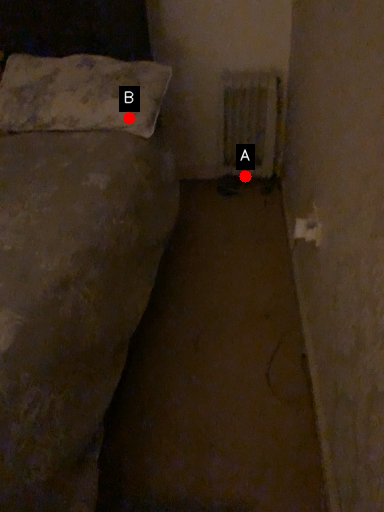
Question: Two points are circled on the image, labeled by A and B beside each circle. Among these points, which one is nearest to the camera?

Choices:
 (A) A is closer
 (B) B is closer

Answer: (B)